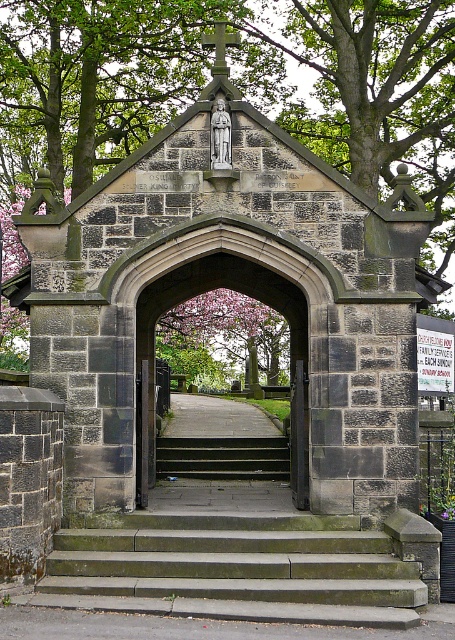
Is dark stone archway at center smaller than dark gray concrete stairs at center?

No.

From the picture: Can you confirm if dark stone archway at center is positioned below dark gray concrete stairs at center?

No, dark stone archway at center is not below dark gray concrete stairs at center.

From the picture: Who is more forward, (216,288) or (195,440)?

Point (216,288) is in front.

Where is `dark stone archway at center`? Image resolution: width=455 pixels, height=640 pixels. dark stone archway at center is located at coordinates (216, 288).

Between point (146, 593) and point (424, 346), which one is positioned behind?

The point (424, 346) is more distant.

At what (x,y) coordinates should I click in order to perform the action: click on green stone stairs at center. Please return your answer as a coordinate pair (x, y). Image resolution: width=455 pixels, height=640 pixels. Looking at the image, I should click on pos(234,570).

Where is `green stone stairs at center`? This screenshot has width=455, height=640. green stone stairs at center is located at coordinates (234, 570).

From the picture: Is white plastic sign at center bigger than wooden door at center?

Correct, white plastic sign at center is larger in size than wooden door at center.

Describe the element at coordinates (435, 358) in the screenshot. The height and width of the screenshot is (640, 455). I see `white plastic sign at center` at that location.

Find the location of a particular element. This screenshot has height=640, width=455. white plastic sign at center is located at coordinates (435, 358).